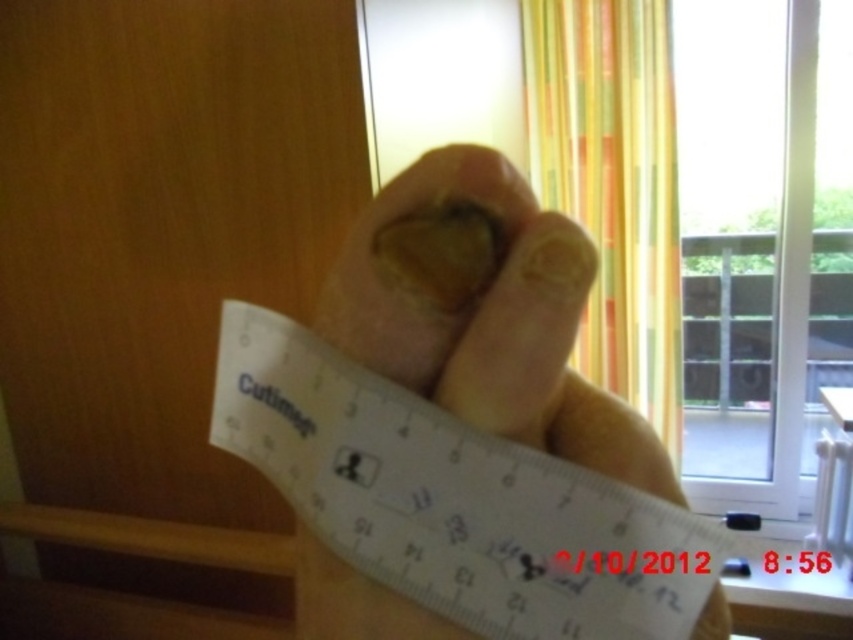
You are trying to determine which of the two points, point (283, 387) or point (659, 336), is nearer to you in the image. Based on the scene, which point is closer?

Point (283, 387) is closer to the viewer than point (659, 336).

You are trying to place a sticker exactly at the center of the transparent plastic ruler at center. According to the coordinates provided, what are the coordinates where you should place the sticker?

The coordinates for the center of the transparent plastic ruler at center are at point (453, 499).